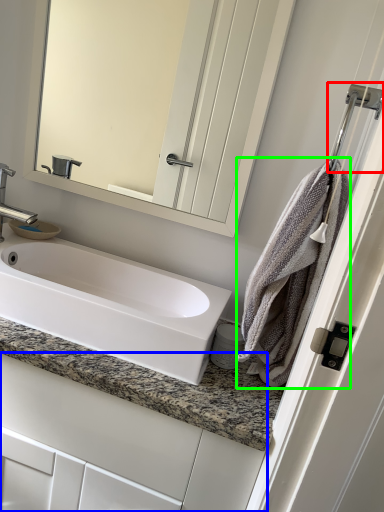
Question: Based on their relative distances, which object is nearer to shower (highlighted by a red box)? Choose from bathroom cabinet (highlighted by a blue box) and bath towel (highlighted by a green box).

Choices:
 (A) bathroom cabinet
 (B) bath towel

Answer: (B)